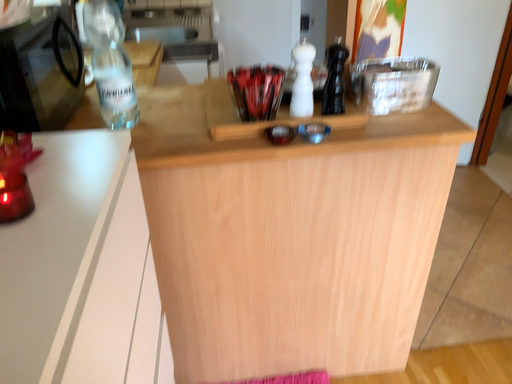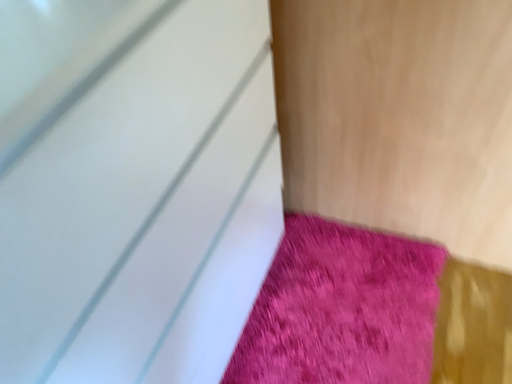
Question: How did the camera likely rotate when shooting the video?

Choices:
 (A) rotated left
 (B) rotated right

Answer: (A)